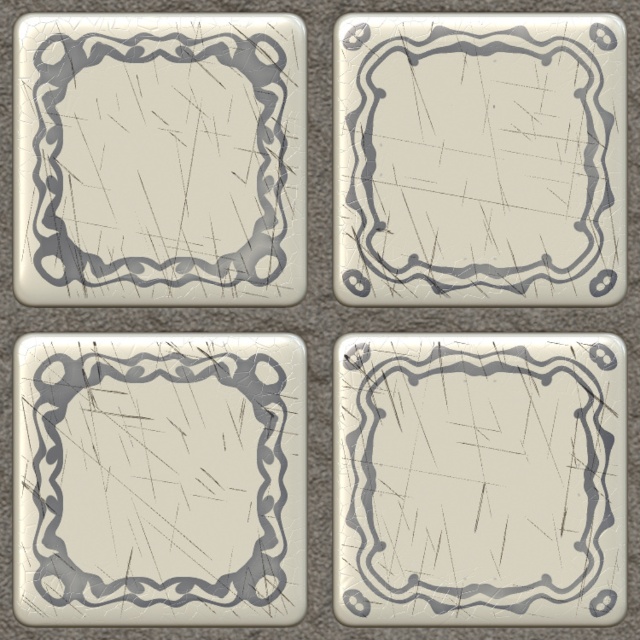
Question: Which point is farther to the camera?

Choices:
 (A) matte white frame at center
 (B) matte silver frame at upper left

Answer: (B)

Question: Which point is farther to the camera?

Choices:
 (A) (132, 356)
 (B) (554, 88)
 (C) (346, 497)
 (D) (298, 276)

Answer: (D)

Question: Which point is closer to the camera?

Choices:
 (A) (552, 216)
 (B) (502, 556)
 (C) (195, 266)
 (D) (20, 458)

Answer: (B)

Question: Is matte plastic frame at upper right below matte white frame at center?

Choices:
 (A) yes
 (B) no

Answer: (B)

Question: Does matte plastic frame at upper right have a smaller size compared to matte white frame at center?

Choices:
 (A) yes
 (B) no

Answer: (A)

Question: Does matte plastic frame at upper right have a smaller size compared to matte silver frame at upper left?

Choices:
 (A) no
 (B) yes

Answer: (A)